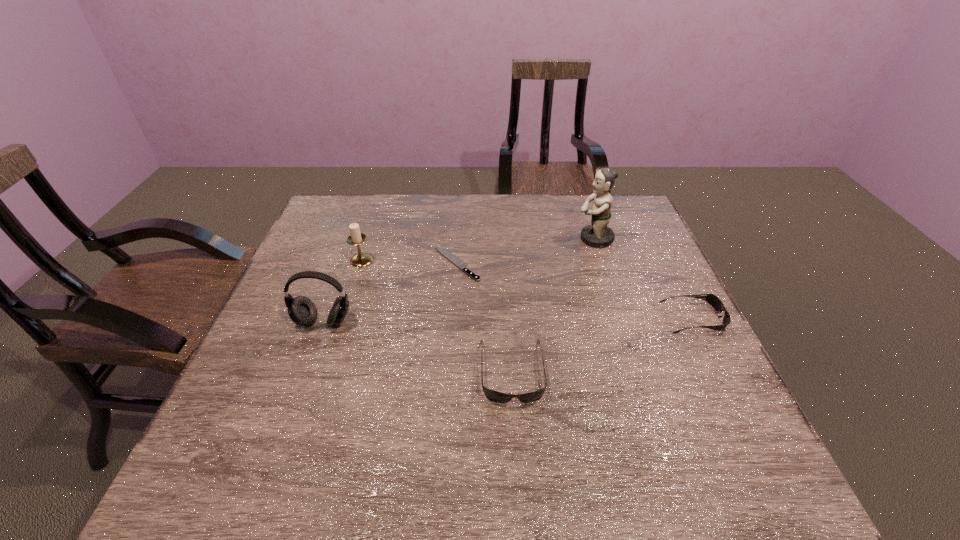
Locate an element on the screen. The image size is (960, 540). vacant area that lies between the rightmost object and the tallest object is located at coordinates (644, 278).

I want to click on vacant space that's between the steak knife and the second tallest object, so click(390, 293).

Identify the location of free area in between the right sunglasses and the third tallest object. This screenshot has width=960, height=540. (527, 289).

Identify the location of vacant point located between the candle holder and the third object from left to right. Image resolution: width=960 pixels, height=540 pixels. (409, 262).

Identify the location of free space between the third object from right to left and the steak knife. (484, 317).

This screenshot has height=540, width=960. What are the coordinates of `vacant region between the headset and the third object from left to right` in the screenshot? It's located at (390, 293).

You are a GUI agent. You are given a task and a screenshot of the screen. Output one action in this format:
    pyautogui.click(x=<x>, y=<y>)
    Task: Click on the vacant area that lies between the third tallest object and the figurine
    
    Given the screenshot: What is the action you would take?
    pyautogui.click(x=478, y=249)

Where is `the fourth closest object to the rightmost object`? The width and height of the screenshot is (960, 540). the fourth closest object to the rightmost object is located at coordinates (302, 311).

Identify which object is located as the second nearest to the farther sunglasses. Please provide its 2D coordinates. Your answer should be formatted as a tuple, i.e. [(x, y)], where the tuple contains the x and y coordinates of a point satisfying the conditions above.

[(495, 396)]

At what (x,y) coordinates should I click in order to perform the action: click on blank area in the image that satisfies the following two spatial constraints: 1. on the front-facing side of the second object from right to left; 2. on the front-facing side of the fourth tallest object. Please return your answer as a coordinate pair (x, y). This screenshot has width=960, height=540. Looking at the image, I should click on (637, 370).